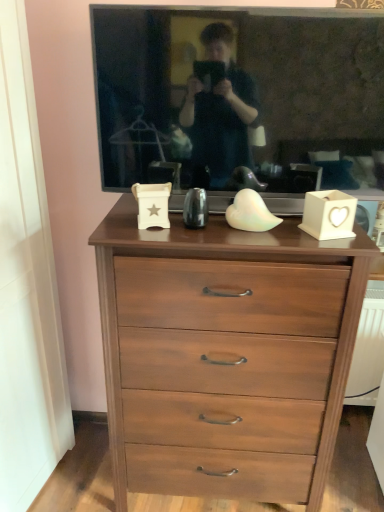
Question: Is walnut wood chest of drawers at center spatially inside matte black tv at upper center, or outside of it?

Choices:
 (A) inside
 (B) outside

Answer: (B)

Question: Considering the positions of walnut wood chest of drawers at center and matte black tv at upper center in the image, is walnut wood chest of drawers at center bigger or smaller than matte black tv at upper center?

Choices:
 (A) big
 (B) small

Answer: (A)

Question: Based on their positions, is walnut wood chest of drawers at center located to the left or right of matte black tv at upper center?

Choices:
 (A) right
 (B) left

Answer: (B)

Question: Is matte black tv at upper center spatially inside walnut wood chest of drawers at center, or outside of it?

Choices:
 (A) outside
 (B) inside

Answer: (A)

Question: Considering the positions of point (345, 117) and point (183, 253), is point (345, 117) closer or farther from the camera than point (183, 253)?

Choices:
 (A) closer
 (B) farther

Answer: (B)

Question: Looking at their shapes, would you say matte black tv at upper center is wider or thinner than walnut wood chest of drawers at center?

Choices:
 (A) wide
 (B) thin

Answer: (B)

Question: Considering the positions of matte black tv at upper center and walnut wood chest of drawers at center in the image, is matte black tv at upper center taller or shorter than walnut wood chest of drawers at center?

Choices:
 (A) short
 (B) tall

Answer: (A)